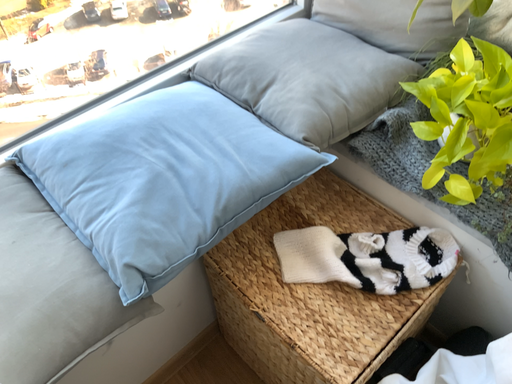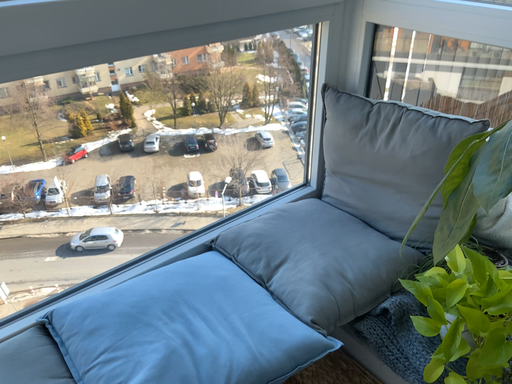
Question: Which way did the camera rotate in the video?

Choices:
 (A) rotated downward
 (B) rotated upward

Answer: (B)